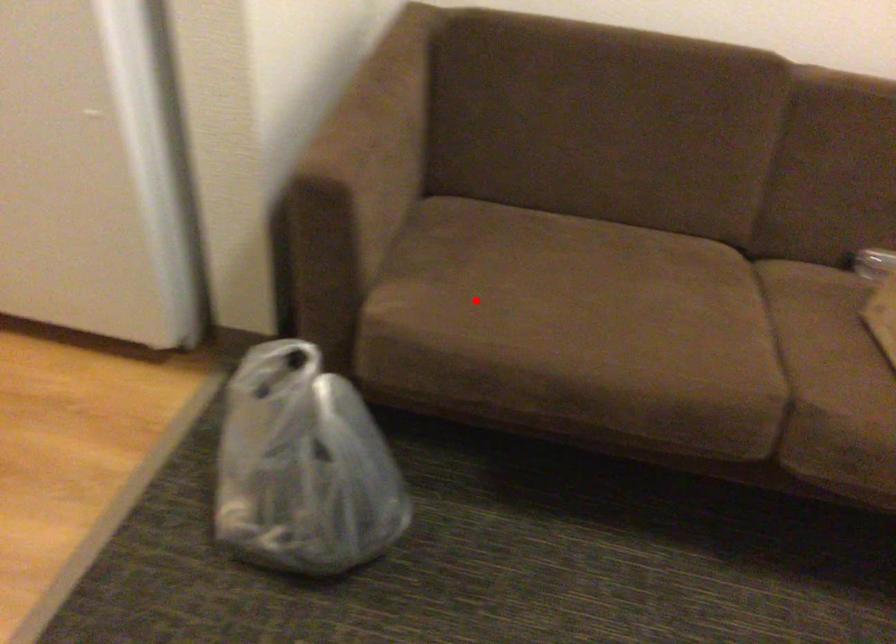
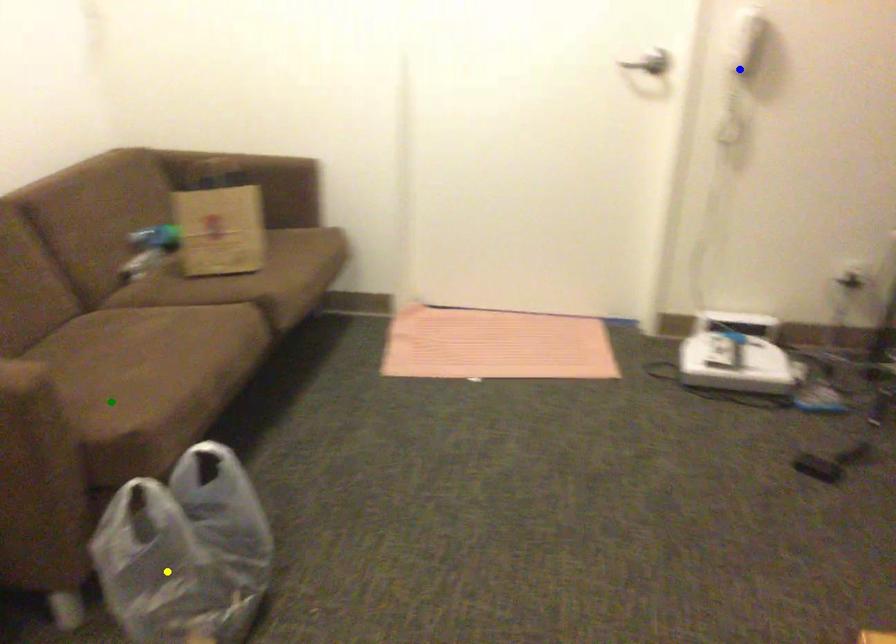
Question: I am providing you with two images of the same scene from different viewpoints. A red point is marked on the first image. You are given multiple points on the second image. Which mark in image 2 goes with the point in image 1?

Choices:
 (A) blue point
 (B) green point
 (C) yellow point

Answer: (B)